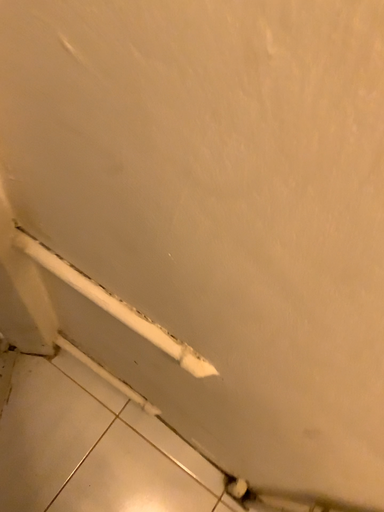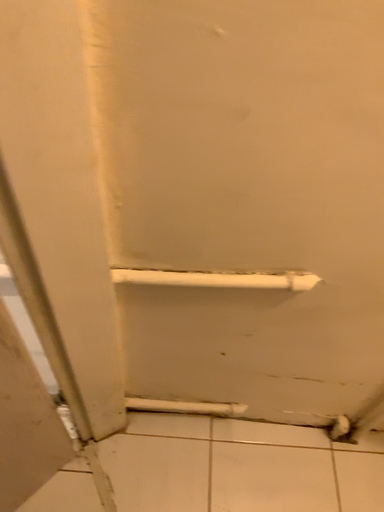
Question: How did the camera likely rotate when shooting the video?

Choices:
 (A) rotated left
 (B) rotated right

Answer: (B)